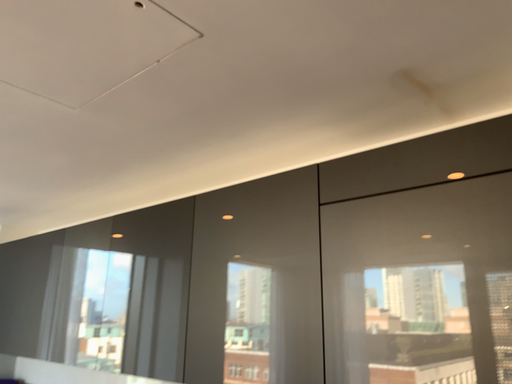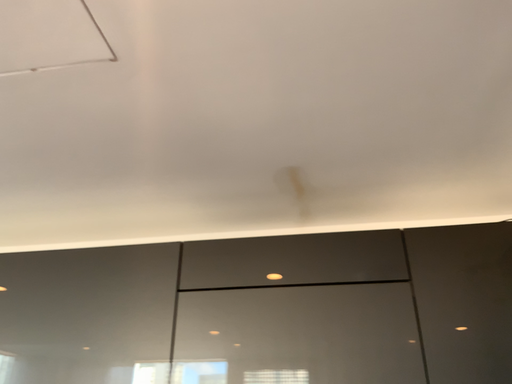
Question: How did the camera likely rotate when shooting the video?

Choices:
 (A) rotated right
 (B) rotated left

Answer: (A)